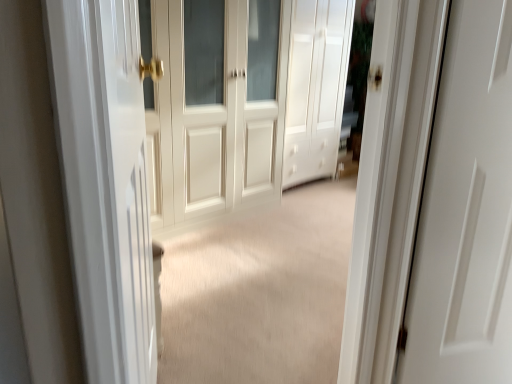
What do you see at coordinates (316, 88) in the screenshot? I see `white matte cabinet at center, acting as the second door starting from the left` at bounding box center [316, 88].

Image resolution: width=512 pixels, height=384 pixels. Describe the element at coordinates (105, 182) in the screenshot. I see `white glossy door at left` at that location.

Measure the distance between white wood door at center, the 1th door when ordered from left to right, and camera.

They are 6.93 feet apart.

At what (x,y) coordinates should I click in order to perform the action: click on white matte cabinet at center, acting as the second door starting from the left. Please return your answer as a coordinate pair (x, y). Looking at the image, I should click on (316, 88).

Which object is positioned more to the right, white matte cabinet at center, acting as the second door starting from the left, or white glossy door at left?

From the viewer's perspective, white matte cabinet at center, acting as the second door starting from the left, appears more on the right side.

Consider the image. Considering the positions of objects white matte cabinet at center, acting as the second door starting from the left, and white glossy door at left in the image provided, who is behind, white matte cabinet at center, acting as the second door starting from the left, or white glossy door at left?

Positioned behind is white matte cabinet at center, acting as the second door starting from the left.

Considering the points (293, 109) and (108, 227), which point is in front, point (293, 109) or point (108, 227)?

The point (108, 227) is closer to the camera.

Is white wood door at center, marked as the second door in a right-to-left arrangement, placed right next to white matte cabinet at center, acting as the second door starting from the left?

white wood door at center, marked as the second door in a right-to-left arrangement, is not next to white matte cabinet at center, acting as the second door starting from the left, and they're not touching.

From a real-world perspective, between white wood door at center, marked as the second door in a right-to-left arrangement, and white matte cabinet at center, which ranks as the 1th door in right-to-left order, who is vertically higher?

In real-world perspective, white matte cabinet at center, which ranks as the 1th door in right-to-left order, is above.

Is white wood door at center, the 1th door when ordered from left to right, bigger or smaller than white matte cabinet at center, which ranks as the 1th door in right-to-left order?

Considering their sizes, white wood door at center, the 1th door when ordered from left to right, takes up more space than white matte cabinet at center, which ranks as the 1th door in right-to-left order.

From a real-world perspective, which object stands above the other?

white matte cabinet at center, acting as the second door starting from the left.

Which of these two, white matte cabinet at center, acting as the second door starting from the left, or white wood door at center, the 1th door when ordered from left to right, stands shorter?

white wood door at center, the 1th door when ordered from left to right, is shorter.

Is the surface of white matte cabinet at center, acting as the second door starting from the left, in direct contact with white wood door at center, marked as the second door in a right-to-left arrangement?

white matte cabinet at center, acting as the second door starting from the left, is not next to white wood door at center, marked as the second door in a right-to-left arrangement, and they're not touching.

From the image's perspective, who appears lower, white glossy door at left or white matte cabinet at center, acting as the second door starting from the left?

white glossy door at left is shown below in the image.

Which is less distant, (82, 210) or (298, 144)?

Point (82, 210).

This screenshot has width=512, height=384. I want to click on door that is the 2nd object located above the white glossy door at left (from the image's perspective), so click(316, 88).

Is white glossy door at left taller than white matte cabinet at center, acting as the second door starting from the left?

No, white glossy door at left is not taller than white matte cabinet at center, acting as the second door starting from the left.

Would you say white wood door at center, the 1th door when ordered from left to right, contains white glossy door at left?

Actually, white glossy door at left is outside white wood door at center, the 1th door when ordered from left to right.

Can you confirm if white wood door at center, marked as the second door in a right-to-left arrangement, is shorter than white glossy door at left?

In fact, white wood door at center, marked as the second door in a right-to-left arrangement, may be taller than white glossy door at left.

Can you see white wood door at center, the 1th door when ordered from left to right, touching white glossy door at left?

white wood door at center, the 1th door when ordered from left to right, and white glossy door at left are clearly separated.

Who is smaller, white wood door at center, the 1th door when ordered from left to right, or white glossy door at left?

With smaller size is white glossy door at left.

Is white glossy door at left not within white wood door at center, the 1th door when ordered from left to right?

That's correct, white glossy door at left is outside of white wood door at center, the 1th door when ordered from left to right.

From a real-world perspective, which is physically below, white glossy door at left or white wood door at center, the 1th door when ordered from left to right?

white glossy door at left is physically lower.

Considering the sizes of objects white glossy door at left and white wood door at center, the 1th door when ordered from left to right, in the image provided, who is taller, white glossy door at left or white wood door at center, the 1th door when ordered from left to right,?

white wood door at center, the 1th door when ordered from left to right, is taller.

Considering the positions of objects white glossy door at left and white wood door at center, the 1th door when ordered from left to right, in the image provided, who is more to the right, white glossy door at left or white wood door at center, the 1th door when ordered from left to right,?

Positioned to the right is white glossy door at left.

At what (x,y) coordinates should I click in order to perform the action: click on screen door that appears in front of the white matte cabinet at center, which ranks as the 1th door in right-to-left order. Please return your answer as a coordinate pair (x, y). The width and height of the screenshot is (512, 384). Looking at the image, I should click on (105, 182).

You are a GUI agent. You are given a task and a screenshot of the screen. Output one action in this format:
    pyautogui.click(x=<x>, y=<y>)
    Task: Click on the door located above the white wood door at center, the 1th door when ordered from left to right (from the image's perspective)
    
    Given the screenshot: What is the action you would take?
    pyautogui.click(x=316, y=88)

Considering their positions, is white wood door at center, marked as the second door in a right-to-left arrangement, positioned further to white glossy door at left than white matte cabinet at center, which ranks as the 1th door in right-to-left order?

white matte cabinet at center, which ranks as the 1th door in right-to-left order, is positioned further to the anchor white glossy door at left.

Estimate the real-world distances between objects in this image. Which object is further from white wood door at center, the 1th door when ordered from left to right, white matte cabinet at center, acting as the second door starting from the left, or white glossy door at left?

white glossy door at left is positioned further to the anchor white wood door at center, the 1th door when ordered from left to right.

Estimate the real-world distances between objects in this image. Which object is closer to white glossy door at left, white matte cabinet at center, acting as the second door starting from the left, or white wood door at center, the 1th door when ordered from left to right?

Among the two, white wood door at center, the 1th door when ordered from left to right, is located nearer to white glossy door at left.

From the image, which object appears to be farther from white matte cabinet at center, which ranks as the 1th door in right-to-left order, white wood door at center, marked as the second door in a right-to-left arrangement, or white glossy door at left?

white glossy door at left is further to white matte cabinet at center, which ranks as the 1th door in right-to-left order.

Based on their spatial positions, is white glossy door at left or white wood door at center, the 1th door when ordered from left to right, further from white matte cabinet at center, acting as the second door starting from the left?

white glossy door at left.

In the scene shown: Looking at the image, which one is located further to white wood door at center, marked as the second door in a right-to-left arrangement, white glossy door at left or white matte cabinet at center, which ranks as the 1th door in right-to-left order?

Based on the image, white glossy door at left appears to be further to white wood door at center, marked as the second door in a right-to-left arrangement.

What are the coordinates of `door located between white glossy door at left and white matte cabinet at center, which ranks as the 1th door in right-to-left order, in the depth direction` in the screenshot? It's located at (214, 106).